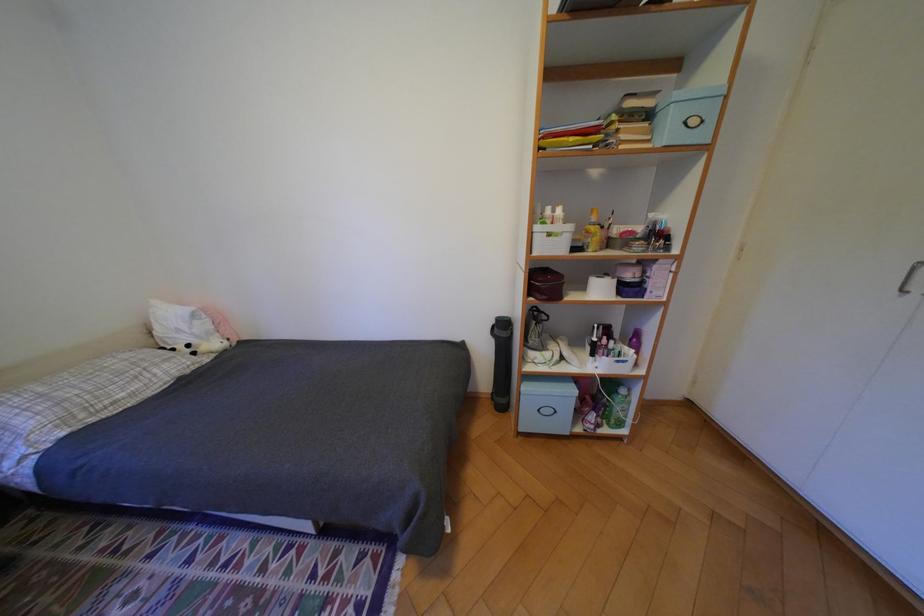
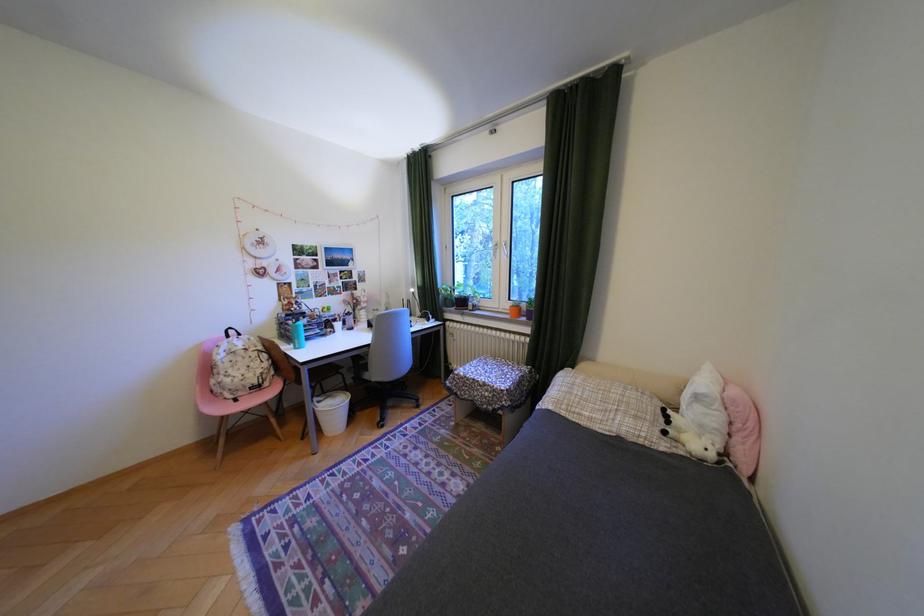
The point at (239, 339) is marked in the first image. Where is the corresponding point in the second image?

(736, 455)